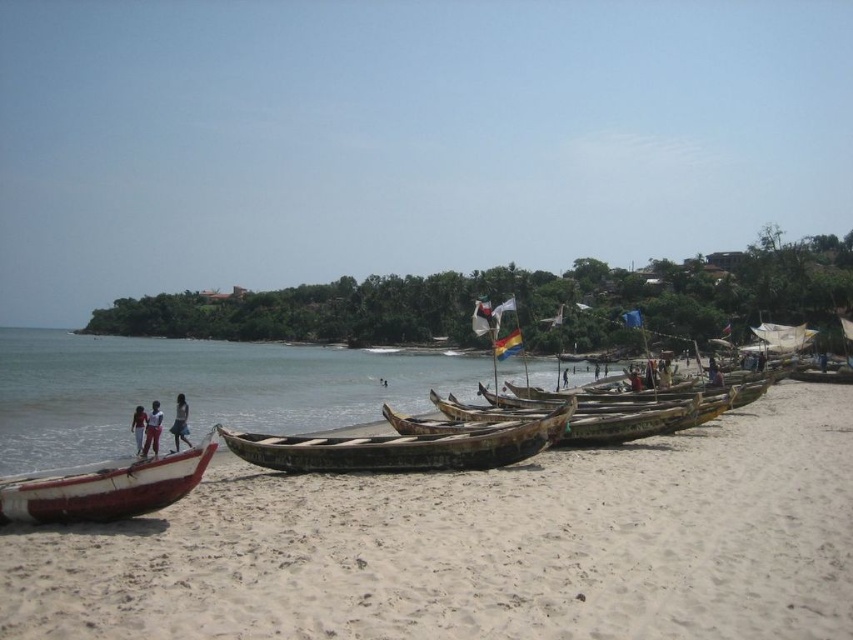
Question: Is white sandy beach at lower left above white wooden boat at lower left?

Choices:
 (A) no
 (B) yes

Answer: (A)

Question: Which object appears farthest from the camera in this image?

Choices:
 (A) white fabric pants at lower left
 (B) rusty wooden canoe at center
 (C) white sandy beach at lower left
 (D) white sand at lower left

Answer: (A)

Question: Which object appears closest to the camera in this image?

Choices:
 (A) white wooden boat at lower left
 (B) white cotton shirt at lower left
 (C) rusty wooden canoe at center

Answer: (A)

Question: Which point is closer to the camera taking this photo?

Choices:
 (A) (657, 416)
 (B) (135, 451)

Answer: (A)

Question: Observing the image, what is the correct spatial positioning of white sandy beach at lower left in reference to rusty wooden canoe at center?

Choices:
 (A) below
 (B) above

Answer: (A)

Question: Does white sandy beach at lower left come behind rusty wooden boat at center?

Choices:
 (A) yes
 (B) no

Answer: (B)